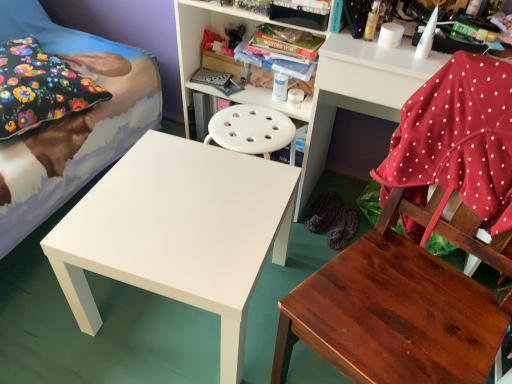
Question: Does point (24, 107) appear closer or farther from the camera than point (195, 54)?

Choices:
 (A) closer
 (B) farther

Answer: (A)

Question: Looking at the image, does floral fabric pillow at upper left seem bigger or smaller compared to white plastic shelf at upper center, the first shelf when ordered from left to right?

Choices:
 (A) small
 (B) big

Answer: (A)

Question: Which of these objects is positioned farthest from the white plastic shelf at upper center, positioned as the 2th shelf in right-to-left order?

Choices:
 (A) white glossy bed at left
 (B) white plastic shelf at upper right, which appears as the 2th shelf when viewed from the left
 (C) floral fabric pillow at upper left
 (D) white matte table at center
 (E) wooden chair at lower right

Answer: (E)

Question: Considering the real-world distances, which object is closest to the white plastic shelf at upper right, which appears as the 2th shelf when viewed from the left?

Choices:
 (A) white matte table at center
 (B) white plastic shelf at upper center, the first shelf when ordered from left to right
 (C) white glossy bed at left
 (D) floral fabric pillow at upper left
 (E) wooden chair at lower right

Answer: (B)